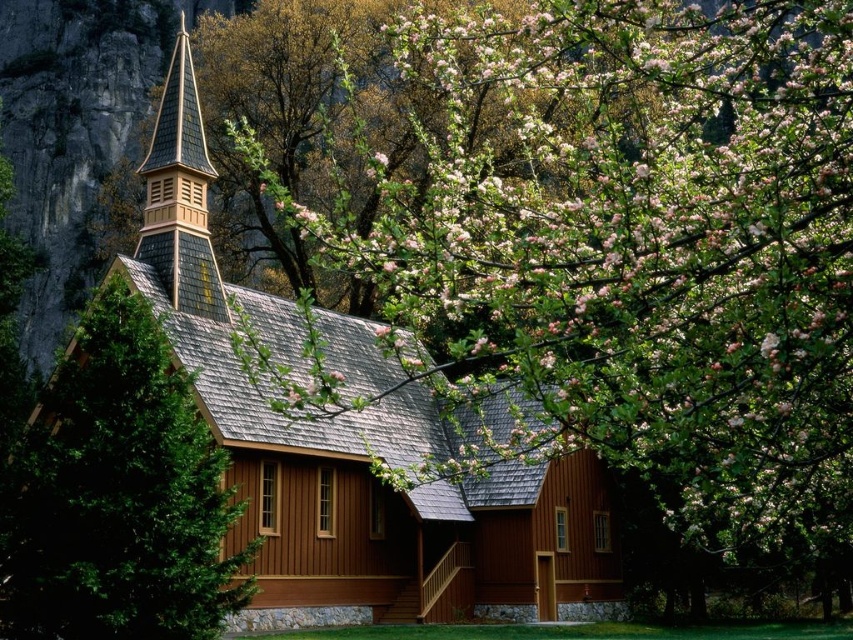
You are standing at the entrance of the chapel and notice a specific point marked at coordinates (x=352, y=452). Based on the scene description, what object does this point most likely represent?

The point at coordinates (x=352, y=452) corresponds to the brown wooden church at center.

You are standing at the base of the wooden stairs leading to the brown wooden church at center. You want to take a photo of the church from a distance where it appears small in the frame. If you walk forward 10 meters, will the church appear larger or smaller in your photo?

The brown wooden church at center is currently 45.70 meters away from the camera. If you walk forward 10 meters, you will be 35.70 meters away. Since the distance decreases, the church will appear larger in the photo.

You are standing at the entrance of the wooden chapel and notice two points marked on the ground. One is labeled as point (392, 525) and the other as point (202, 291). Which point is closer to the chapel steeple?

Point (392, 525) is behind point (202, 291), so the point closer to the chapel steeple is point (202, 291).